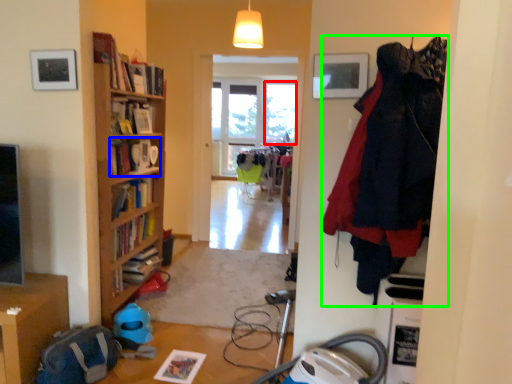
Question: Which object is positioned farthest from window (highlighted by a red box)? Select from book (highlighted by a blue box) and clothing (highlighted by a green box).

Choices:
 (A) book
 (B) clothing

Answer: (B)